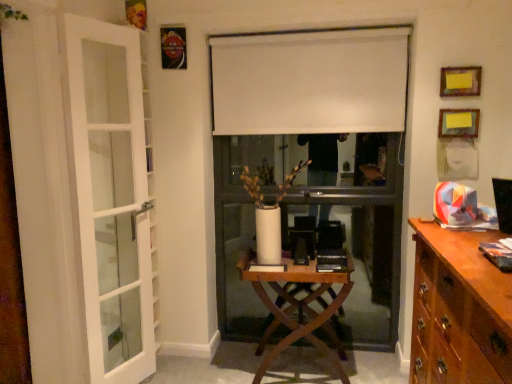
Question: Is wooden at center facing towards white matte curtain at center?

Choices:
 (A) no
 (B) yes

Answer: (A)

Question: Can you confirm if wooden at center is smaller than white matte curtain at center?

Choices:
 (A) no
 (B) yes

Answer: (A)

Question: Is wooden at center with white matte curtain at center?

Choices:
 (A) no
 (B) yes

Answer: (A)

Question: Is wooden at center shorter than white matte curtain at center?

Choices:
 (A) yes
 (B) no

Answer: (B)

Question: Considering the relative positions of wooden at center and white matte curtain at center in the image provided, is wooden at center to the right of white matte curtain at center from the viewer's perspective?

Choices:
 (A) no
 (B) yes

Answer: (A)

Question: Is brown wood cabinet at right inside or outside of white matte curtain at center?

Choices:
 (A) inside
 (B) outside

Answer: (B)

Question: In the image, is brown wood cabinet at right on the left side or the right side of white matte curtain at center?

Choices:
 (A) left
 (B) right

Answer: (B)

Question: In terms of height, does brown wood cabinet at right look taller or shorter compared to white matte curtain at center?

Choices:
 (A) tall
 (B) short

Answer: (A)

Question: Considering the positions of brown wood cabinet at right and white matte curtain at center in the image, is brown wood cabinet at right bigger or smaller than white matte curtain at center?

Choices:
 (A) small
 (B) big

Answer: (B)

Question: From the image's perspective, is wooden at center positioned above or below wooden picture frame at upper right, which is the 1th picture frame in top-to-bottom order?

Choices:
 (A) above
 (B) below

Answer: (B)

Question: Is wooden at center in front of or behind wooden picture frame at upper right, which is the 1th picture frame in top-to-bottom order, in the image?

Choices:
 (A) front
 (B) behind

Answer: (A)

Question: In the image, is wooden at center on the left side or the right side of wooden picture frame at upper right, which is the 1th picture frame in top-to-bottom order?

Choices:
 (A) left
 (B) right

Answer: (A)

Question: From a real-world perspective, is wooden at center above or below wooden picture frame at upper right, which is the 1th picture frame in top-to-bottom order?

Choices:
 (A) below
 (B) above

Answer: (A)

Question: Considering the positions of brown wood cabinet at right and wooden picture frame at upper right, which is the second picture frame from top to bottom, in the image, is brown wood cabinet at right wider or thinner than wooden picture frame at upper right, which is the second picture frame from top to bottom,?

Choices:
 (A) thin
 (B) wide

Answer: (B)

Question: Relative to wooden picture frame at upper right, which is the second picture frame from top to bottom, is brown wood cabinet at right in front or behind?

Choices:
 (A) behind
 (B) front

Answer: (B)